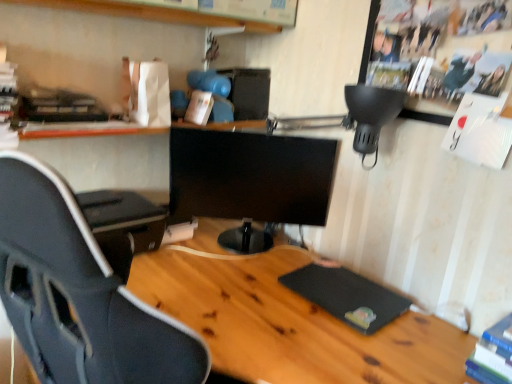
Where is `free space in front of black rubber mousepad at lower right`? The height and width of the screenshot is (384, 512). free space in front of black rubber mousepad at lower right is located at coordinates (353, 348).